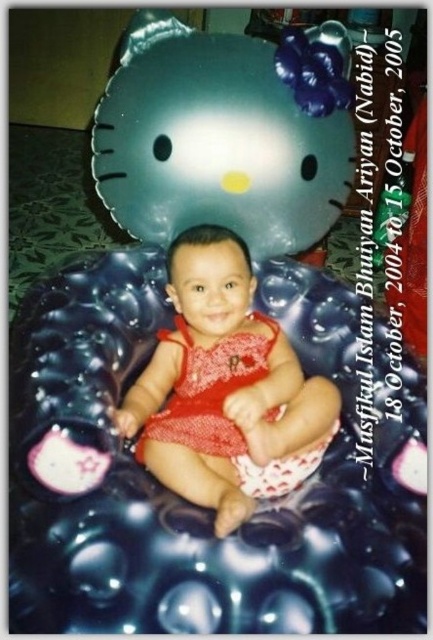
Locate an element on the screen. The height and width of the screenshot is (640, 433). matte blue balloon at upper center is located at coordinates (226, 132).

Does matte blue balloon at upper center have a smaller size compared to red knitted dress at center?

Indeed, matte blue balloon at upper center has a smaller size compared to red knitted dress at center.

What do you see at coordinates (226, 132) in the screenshot? I see `matte blue balloon at upper center` at bounding box center [226, 132].

Identify the location of matte blue balloon at upper center. (226, 132).